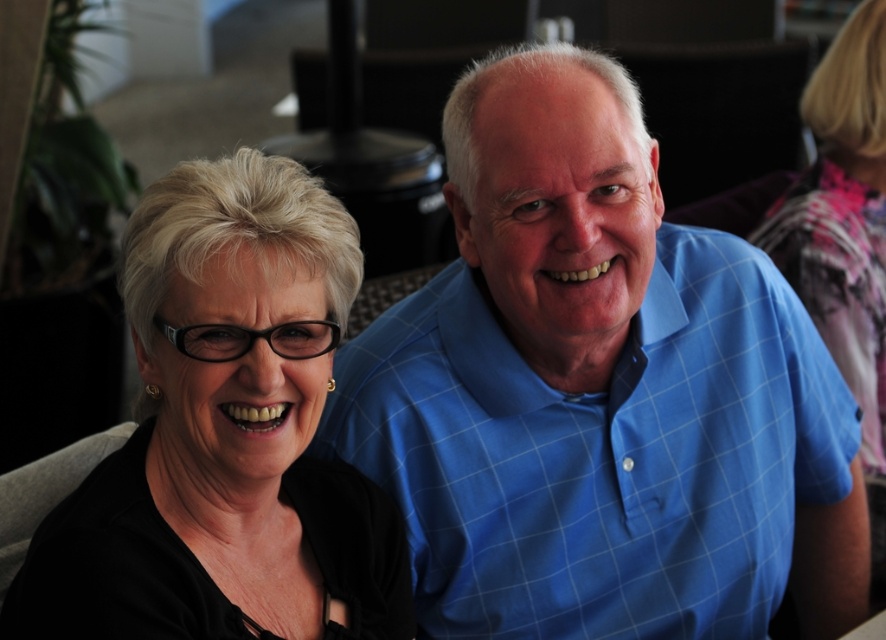
The image size is (886, 640). Describe the element at coordinates (601, 452) in the screenshot. I see `blue checkered shirt at center` at that location.

Is point (741, 300) less distant than point (169, 236)?

That is False.

Where is `blue checkered shirt at center`? blue checkered shirt at center is located at coordinates (601, 452).